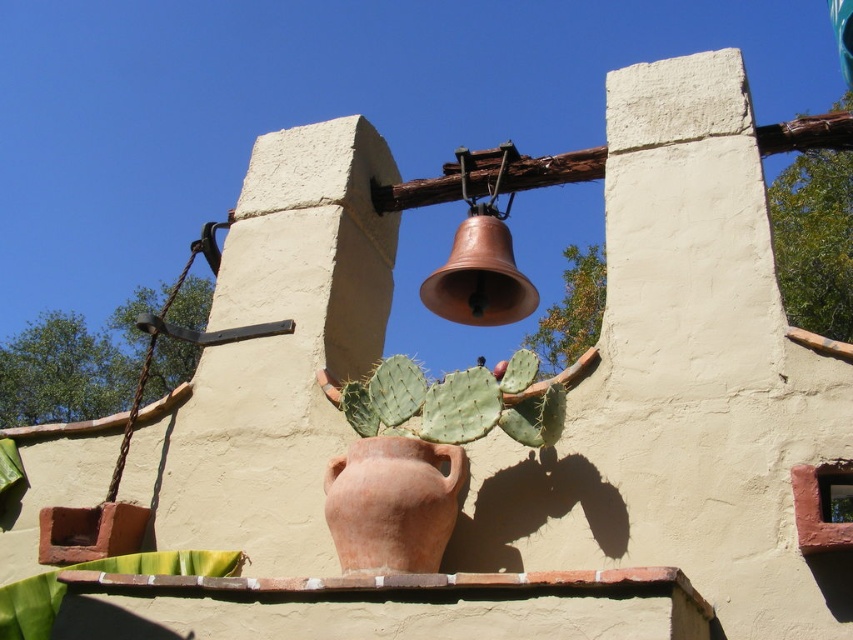
You are standing in front of the beige adobe wall and see the terracotta pot at center and the green spiny cactus at center. Which object is located to the left of the other?

The terracotta pot at center is positioned on the left side of green spiny cactus at center.

You are standing in front of the beige adobe wall and want to place a small decorative item on the ledge where the terracotta pot at center and green spiny cactus at center are located. Which object is nearer to you so you can place the item next to it?

The terracotta pot at center is closer to the viewer than the green spiny cactus at center, so you can place the item next to the terracotta pot at center.